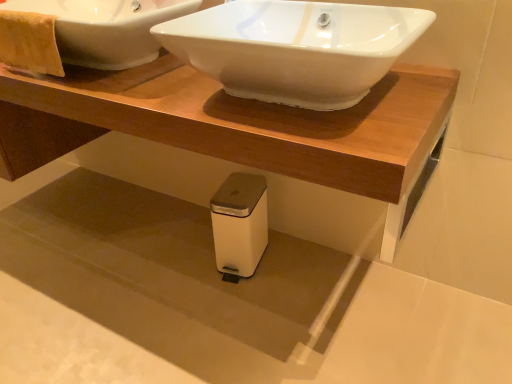
This screenshot has width=512, height=384. In order to click on free location to the right of yellow textured towel at upper left in this screenshot , I will do `click(125, 76)`.